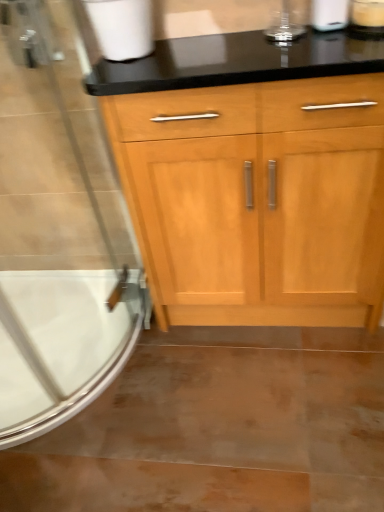
What is the approximate width of white matte toilet paper at upper left, the first toilet paper from the left?

The width of white matte toilet paper at upper left, the first toilet paper from the left, is 25.20 centimeters.

The height and width of the screenshot is (512, 384). I want to click on white matte toilet paper at upper right, placed as the 2th toilet paper when sorted from left to right, so click(x=329, y=14).

This screenshot has width=384, height=512. I want to click on clear glass screen door at left, so click(x=57, y=231).

Find the location of a particular element. white glossy bathtub at lower left is located at coordinates (60, 345).

What are the coordinates of `white matte toilet paper at upper left, the first toilet paper from the left` in the screenshot? It's located at (122, 27).

Between white glossy bathtub at lower left and clear glass screen door at left, which one appears on the left side from the viewer's perspective?

white glossy bathtub at lower left is more to the left.

Does white glossy bathtub at lower left have a lesser width compared to clear glass screen door at left?

No, white glossy bathtub at lower left is not thinner than clear glass screen door at left.

Are white glossy bathtub at lower left and clear glass screen door at left far apart?

No.

Measure the distance between white glossy bathtub at lower left and clear glass screen door at left.

The distance of white glossy bathtub at lower left from clear glass screen door at left is 13.00 centimeters.

Considering the relative sizes of white matte toilet paper at upper left, the second toilet paper positioned from the right, and white matte toilet paper at upper right, acting as the first toilet paper starting from the right, in the image provided, is white matte toilet paper at upper left, the second toilet paper positioned from the right, thinner than white matte toilet paper at upper right, acting as the first toilet paper starting from the right,?

In fact, white matte toilet paper at upper left, the second toilet paper positioned from the right, might be wider than white matte toilet paper at upper right, acting as the first toilet paper starting from the right.

In the scene shown: From a real-world perspective, between white matte toilet paper at upper left, the first toilet paper from the left, and white matte toilet paper at upper right, acting as the first toilet paper starting from the right, who is vertically lower?

white matte toilet paper at upper left, the first toilet paper from the left.

Where is `toilet paper below the white matte toilet paper at upper right, placed as the 2th toilet paper when sorted from left to right (from the image's perspective)`? The height and width of the screenshot is (512, 384). toilet paper below the white matte toilet paper at upper right, placed as the 2th toilet paper when sorted from left to right (from the image's perspective) is located at coordinates (122, 27).

From the image's perspective, is white matte toilet paper at upper left, the second toilet paper positioned from the right, on white matte toilet paper at upper right, acting as the first toilet paper starting from the right?

No, from the image's perspective, white matte toilet paper at upper left, the second toilet paper positioned from the right, is not above white matte toilet paper at upper right, acting as the first toilet paper starting from the right.

Who is shorter, clear glass screen door at left or white matte toilet paper at upper right, placed as the 2th toilet paper when sorted from left to right?

Standing shorter between the two is white matte toilet paper at upper right, placed as the 2th toilet paper when sorted from left to right.

Which point is more distant from viewer, [108,230] or [340,2]?

The point [108,230] is farther.

Is clear glass screen door at left oriented away from white matte toilet paper at upper right, placed as the 2th toilet paper when sorted from left to right?

clear glass screen door at left does not have its back to white matte toilet paper at upper right, placed as the 2th toilet paper when sorted from left to right.

From a real-world perspective, which object rests below the other?

clear glass screen door at left.

Considering the positions of objects white matte toilet paper at upper right, placed as the 2th toilet paper when sorted from left to right, and satin nickel faucet at upper left in the image provided, who is more to the left, white matte toilet paper at upper right, placed as the 2th toilet paper when sorted from left to right, or satin nickel faucet at upper left?

satin nickel faucet at upper left is more to the left.

Is white matte toilet paper at upper right, placed as the 2th toilet paper when sorted from left to right, bigger or smaller than satin nickel faucet at upper left?

In the image, white matte toilet paper at upper right, placed as the 2th toilet paper when sorted from left to right, appears to be smaller than satin nickel faucet at upper left.

In the scene shown: Which of these two, white matte toilet paper at upper right, acting as the first toilet paper starting from the right, or satin nickel faucet at upper left, is wider?

Wider between the two is white matte toilet paper at upper right, acting as the first toilet paper starting from the right.

From the satin nickel faucet at upper left, count 2nd toilet papers forward and point to it. Please provide its 2D coordinates.

[(329, 14)]

Which point is more distant from viewer, (109, 347) or (37, 29)?

Point (109, 347)

How much distance is there between white glossy bathtub at lower left and satin nickel faucet at upper left?

A distance of 38.96 inches exists between white glossy bathtub at lower left and satin nickel faucet at upper left.

Is satin nickel faucet at upper left completely or partially inside white glossy bathtub at lower left?

No, white glossy bathtub at lower left does not contain satin nickel faucet at upper left.

Is white matte toilet paper at upper right, placed as the 2th toilet paper when sorted from left to right, wider than clear glass screen door at left?

In fact, white matte toilet paper at upper right, placed as the 2th toilet paper when sorted from left to right, might be narrower than clear glass screen door at left.

Measure the distance between white matte toilet paper at upper right, placed as the 2th toilet paper when sorted from left to right, and clear glass screen door at left.

3.98 feet.

Is white matte toilet paper at upper right, acting as the first toilet paper starting from the right, not near clear glass screen door at left?

Yes, white matte toilet paper at upper right, acting as the first toilet paper starting from the right, and clear glass screen door at left are quite far apart.

Is the depth of white matte toilet paper at upper right, placed as the 2th toilet paper when sorted from left to right, less than that of clear glass screen door at left?

No, white matte toilet paper at upper right, placed as the 2th toilet paper when sorted from left to right, is further to the viewer.

Based on their sizes in the image, would you say satin nickel faucet at upper left is bigger or smaller than white matte toilet paper at upper right, acting as the first toilet paper starting from the right?

In the image, satin nickel faucet at upper left appears to be larger than white matte toilet paper at upper right, acting as the first toilet paper starting from the right.

Is satin nickel faucet at upper left shorter than white matte toilet paper at upper right, placed as the 2th toilet paper when sorted from left to right?

In fact, satin nickel faucet at upper left may be taller than white matte toilet paper at upper right, placed as the 2th toilet paper when sorted from left to right.

Is satin nickel faucet at upper left further to camera compared to white matte toilet paper at upper right, placed as the 2th toilet paper when sorted from left to right?

Yes, satin nickel faucet at upper left is further from the camera.

Locate an element on the screen. This screenshot has width=384, height=512. the 1st toilet paper positioned below the satin nickel faucet at upper left (from a real-world perspective) is located at coordinates (329, 14).

The width and height of the screenshot is (384, 512). I want to click on screen door to the right of white glossy bathtub at lower left, so pyautogui.click(x=57, y=231).

You are a GUI agent. You are given a task and a screenshot of the screen. Output one action in this format:
    pyautogui.click(x=<x>, y=<y>)
    Task: Click on the toilet paper below the white matte toilet paper at upper right, placed as the 2th toilet paper when sorted from left to right (from a real-world perspective)
    The image size is (384, 512).
    Given the screenshot: What is the action you would take?
    pyautogui.click(x=122, y=27)

Based on their spatial positions, is satin nickel faucet at upper left or white matte toilet paper at upper right, acting as the first toilet paper starting from the right, closer to clear glass screen door at left?

satin nickel faucet at upper left is positioned closer to the anchor clear glass screen door at left.

Based on the photo, which object lies nearer to the anchor point white matte toilet paper at upper left, the second toilet paper positioned from the right, white glossy bathtub at lower left or white matte toilet paper at upper right, acting as the first toilet paper starting from the right?

white matte toilet paper at upper right, acting as the first toilet paper starting from the right, is closer to white matte toilet paper at upper left, the second toilet paper positioned from the right.

When comparing their distances from satin nickel faucet at upper left, does white matte toilet paper at upper right, placed as the 2th toilet paper when sorted from left to right, or white matte toilet paper at upper left, the second toilet paper positioned from the right, seem further?

white matte toilet paper at upper right, placed as the 2th toilet paper when sorted from left to right, is further to satin nickel faucet at upper left.

Looking at the image, which one is located closer to satin nickel faucet at upper left, white glossy bathtub at lower left or white matte toilet paper at upper right, acting as the first toilet paper starting from the right?

white matte toilet paper at upper right, acting as the first toilet paper starting from the right.

Estimate the real-world distances between objects in this image. Which object is further from white matte toilet paper at upper left, the first toilet paper from the left, satin nickel faucet at upper left or clear glass screen door at left?

clear glass screen door at left.

Based on their spatial positions, is clear glass screen door at left or white glossy bathtub at lower left closer to white matte toilet paper at upper left, the second toilet paper positioned from the right?

clear glass screen door at left is positioned closer to the anchor white matte toilet paper at upper left, the second toilet paper positioned from the right.

Based on their spatial positions, is white matte toilet paper at upper right, acting as the first toilet paper starting from the right, or clear glass screen door at left closer to satin nickel faucet at upper left?

clear glass screen door at left.

Estimate the real-world distances between objects in this image. Which object is further from satin nickel faucet at upper left, clear glass screen door at left or white matte toilet paper at upper right, placed as the 2th toilet paper when sorted from left to right?

Based on the image, white matte toilet paper at upper right, placed as the 2th toilet paper when sorted from left to right, appears to be further to satin nickel faucet at upper left.

Find the location of a particular element. The height and width of the screenshot is (512, 384). screen door that lies between satin nickel faucet at upper left and white glossy bathtub at lower left from top to bottom is located at coordinates (57, 231).

Locate an element on the screen. toilet paper between satin nickel faucet at upper left and white matte toilet paper at upper right, placed as the 2th toilet paper when sorted from left to right, from left to right is located at coordinates (122, 27).

The image size is (384, 512). Identify the location of screen door between white matte toilet paper at upper left, the first toilet paper from the left, and white glossy bathtub at lower left in the up-down direction. (57, 231).

Locate an element on the screen. This screenshot has width=384, height=512. toilet paper between white matte toilet paper at upper right, placed as the 2th toilet paper when sorted from left to right, and white glossy bathtub at lower left from top to bottom is located at coordinates (122, 27).